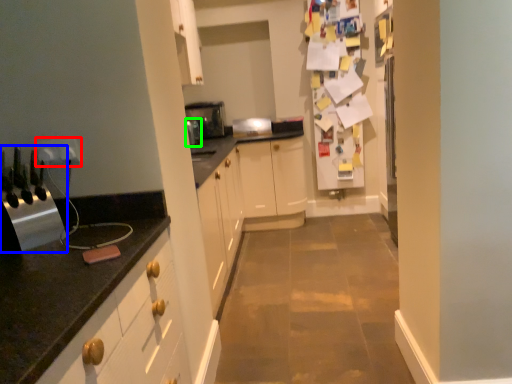
Question: Which object is the closest to the electric outlet (highlighted by a red box)? Choose among these: appliance (highlighted by a blue box) or appliance (highlighted by a green box).

Choices:
 (A) appliance
 (B) appliance

Answer: (A)